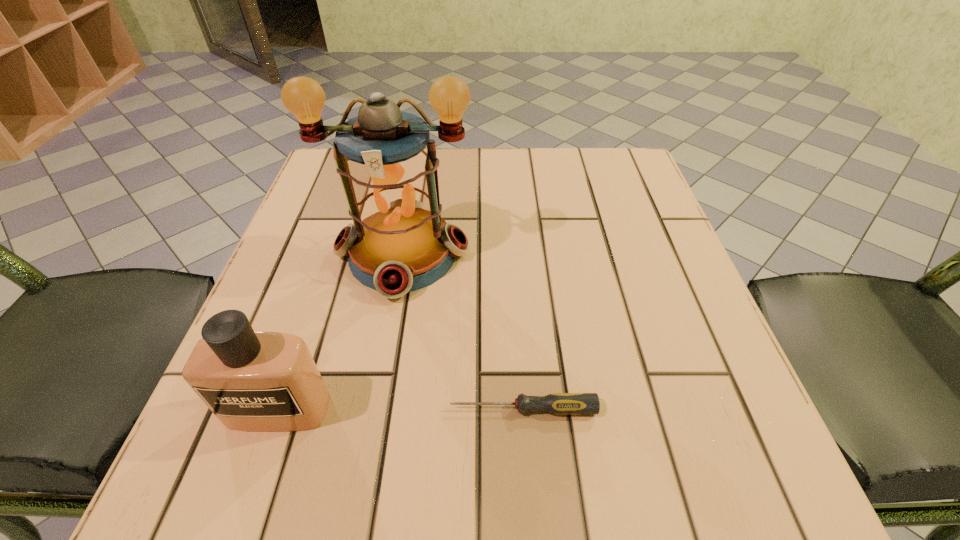
You are a GUI agent. You are given a task and a screenshot of the screen. Output one action in this format:
    pyautogui.click(x=<x>, y=<y>)
    Task: Click on the farthest object
    The width and height of the screenshot is (960, 540).
    Given the screenshot: What is the action you would take?
    pyautogui.click(x=399, y=243)

Locate an element on the screen. The width and height of the screenshot is (960, 540). the tallest object is located at coordinates (399, 243).

You are a GUI agent. You are given a task and a screenshot of the screen. Output one action in this format:
    pyautogui.click(x=<x>, y=<y>)
    Task: Click on the second shortest object
    The image size is (960, 540).
    Given the screenshot: What is the action you would take?
    pyautogui.click(x=251, y=380)

The width and height of the screenshot is (960, 540). I want to click on the shortest object, so click(x=556, y=403).

Locate an element on the screen. The height and width of the screenshot is (540, 960). free point located 0.160m on the front-facing side of the lantern is located at coordinates (378, 388).

This screenshot has width=960, height=540. What are the coordinates of `vacant area located 0.070m on the front label of the perfume` in the screenshot? It's located at (252, 487).

Where is `vacant position located 0.190m insert the shortest object into a screw head`? The width and height of the screenshot is (960, 540). vacant position located 0.190m insert the shortest object into a screw head is located at coordinates (316, 409).

I want to click on vacant space located 0.210m insert the shortest object into a screw head, so click(301, 409).

Where is `free location located insert the shortest object into a screw head`? Image resolution: width=960 pixels, height=540 pixels. free location located insert the shortest object into a screw head is located at coordinates (224, 409).

The width and height of the screenshot is (960, 540). In order to click on object at the near edge in this screenshot , I will do `click(251, 380)`.